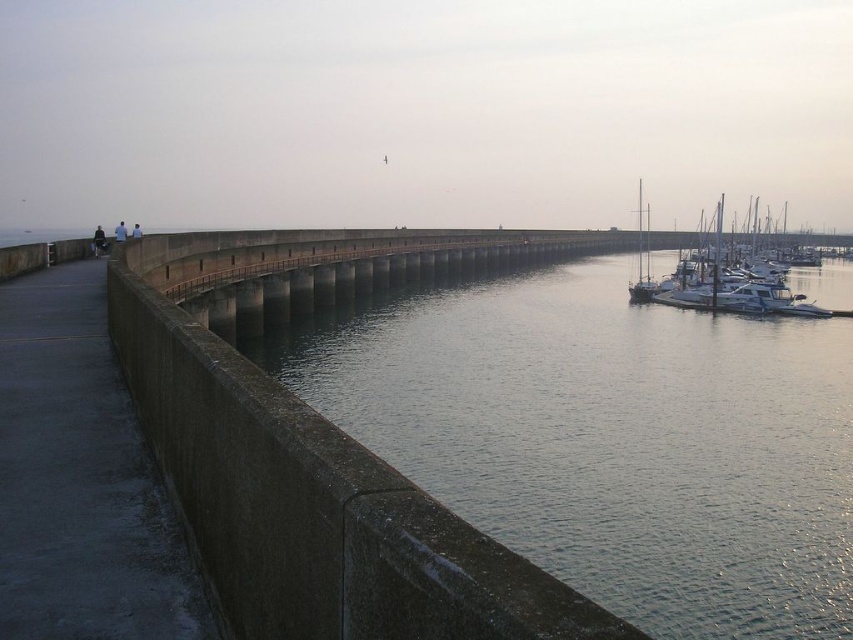
Is white glossy sailboat at right smaller than dark blue jeans at left?

Incorrect, white glossy sailboat at right is not smaller in size than dark blue jeans at left.

Is white glossy sailboat at right further to camera compared to dark blue jeans at left?

Yes, it is.

Identify the location of white glossy sailboat at right. (718, 291).

Does smooth concrete water at center come in front of white glossy sailboat at right?

Yes, smooth concrete water at center is closer to the viewer.

In order to click on smooth concrete water at center in this screenshot , I will do `click(610, 438)`.

Who is higher up, smooth concrete water at center or dark blue jeans at left?

dark blue jeans at left is higher up.

Describe the element at coordinates (610, 438) in the screenshot. I see `smooth concrete water at center` at that location.

Does point (791, 282) lie behind point (125, 225)?

No, (791, 282) is closer to viewer.

You are a GUI agent. You are given a task and a screenshot of the screen. Output one action in this format:
    pyautogui.click(x=<x>, y=<y>)
    Task: Click on the smooth concrete water at center
    This screenshot has height=640, width=853.
    Given the screenshot: What is the action you would take?
    pyautogui.click(x=610, y=438)